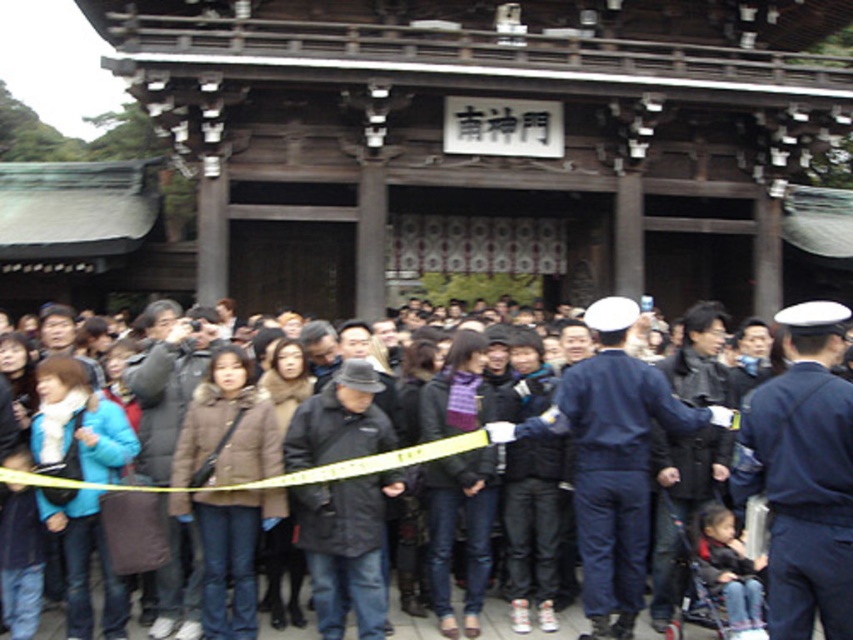
From the picture: You are standing in front of the shrine and notice two points marked in the scene. Which point, point (x=804, y=586) or point (x=596, y=620), is closer to you?

Point (x=804, y=586) is closer to the viewer than point (x=596, y=620).

You are a visitor at the temple and see the blue uniform at center and the dark gray coat at center. Which one is covering the other?

The blue uniform at center is positioned over dark gray coat at center, so the blue uniform is covering the dark gray coat.

You are standing in front of the traditional Japanese shrine and want to take a photo. There are two points marked in the scene, point A at coordinates point (805,560) and point B at coordinates point (788,316). Which point is closer to your current position?

Point point (805,560) is closer to the camera than point point (788,316), so point A is closer to your current position.